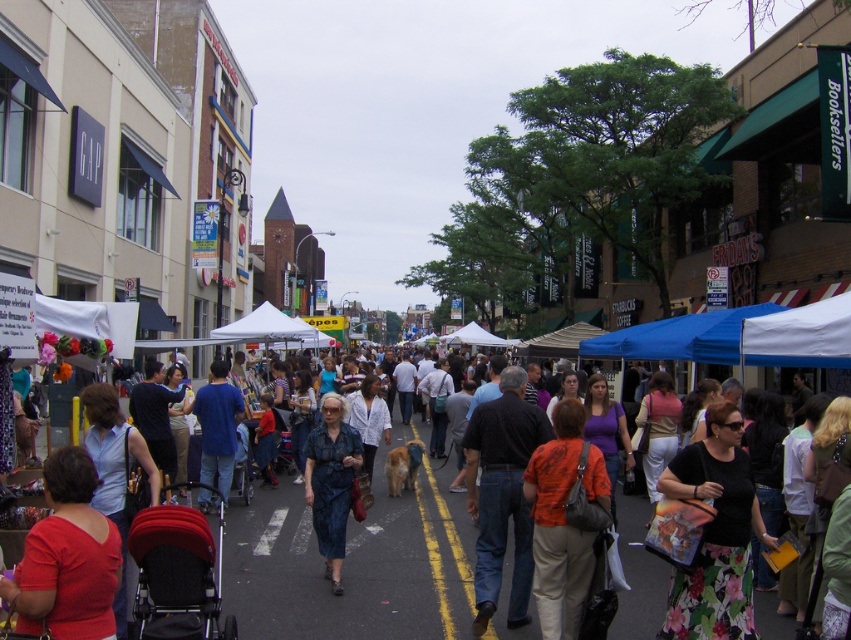
You are a customer at the market and want to pick up the orange fabric shirt at center and the blue cotton shirt at center. Which one should you approach first to reach them in the shortest path?

You should approach the orange fabric shirt at center first since it is closer to you than the blue cotton shirt at center.

You are a vendor at the market and want to display two shirts, the orange fabric shirt at center and the blue cotton shirt at center, on a rack. Which shirt should you place on the top shelf if you want the taller one to be more visible?

The orange fabric shirt at center is taller than the blue cotton shirt at center, so placing it on the top shelf will make it more visible.

You are standing at the camera position in the market scene. There is a point at coordinates (563, 620). If you want to walk directly to that point, how far will you have to walk?

The point at coordinates (563, 620) is 5.75 meters away from the camera position, so you will have to walk 5.75 meters to reach it.